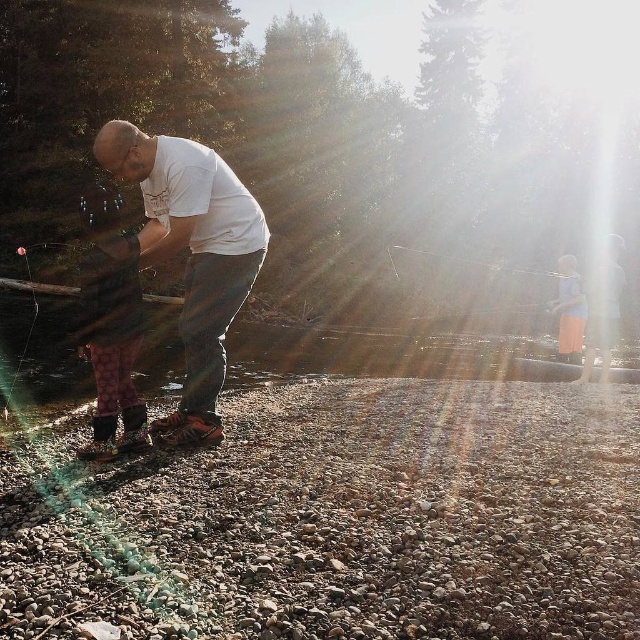
You are an observer standing on the riverbank. You notice the white matte shirt at center and the patterned fabric pants at left. Which clothing item is wider?

The white matte shirt at center is wider than the patterned fabric pants at left.

Consider the image. You are standing on the riverbank and see the patterned fabric pants at left and the light blue fabric dress at right. Which one is closer to the water?

The patterned fabric pants at left is closer to the water because it is positioned below the light blue fabric dress at right, indicating it is lower in elevation towards the river.

You are standing at the camera position and want to pick up the patterned fabric pants at left. Can you reach them without moving your feet?

The patterned fabric pants at left and camera are 3.32 meters apart from each other, so you cannot reach them without moving your feet as the distance is too far.